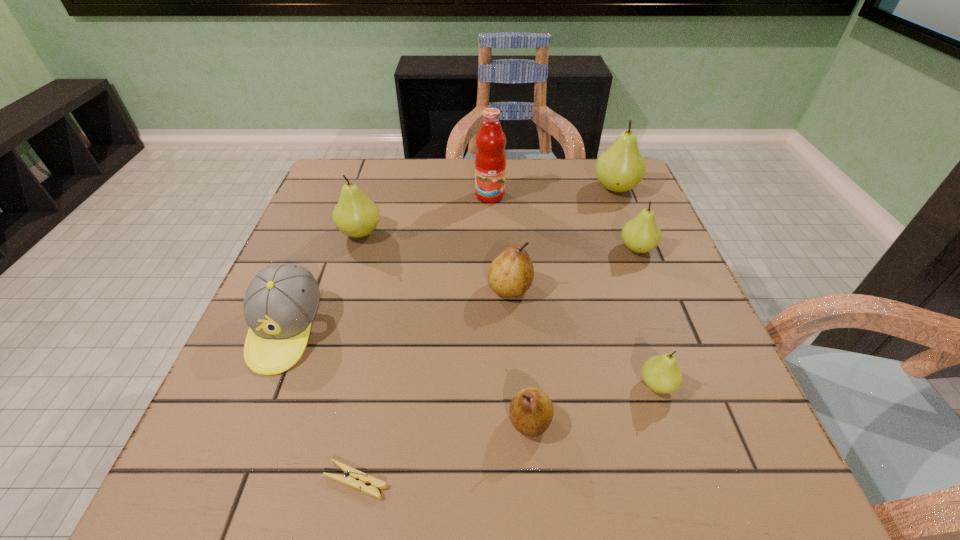
In order to click on vacant area situated on the front of the smallest green pear in this screenshot , I will do `click(692, 492)`.

I want to click on vacant space located on the back of the shortest object, so click(x=379, y=361).

You are a GUI agent. You are given a task and a screenshot of the screen. Output one action in this format:
    pyautogui.click(x=<x>, y=<y>)
    Task: Click on the fruit juice that is at the far edge
    
    Given the screenshot: What is the action you would take?
    pyautogui.click(x=490, y=159)

This screenshot has width=960, height=540. I want to click on pear that is at the far edge, so click(620, 168).

At what (x,y) coordinates should I click in order to perform the action: click on object located at the near edge. Please return your answer as a coordinate pair (x, y). Looking at the image, I should click on (356, 479).

You are a GUI agent. You are given a task and a screenshot of the screen. Output one action in this format:
    pyautogui.click(x=<x>, y=<y>)
    Task: Click on the pear at the left edge
    This screenshot has height=540, width=960.
    Given the screenshot: What is the action you would take?
    pyautogui.click(x=355, y=215)

I want to click on baseball cap located at the left edge, so click(281, 302).

Locate an element on the screen. The width and height of the screenshot is (960, 540). object at the far right corner is located at coordinates (620, 168).

In the image, there is a desktop. Identify the location of vacant space at the far edge. (566, 202).

Find the location of `vacant space at the left edge of the desktop`. vacant space at the left edge of the desktop is located at coordinates (299, 430).